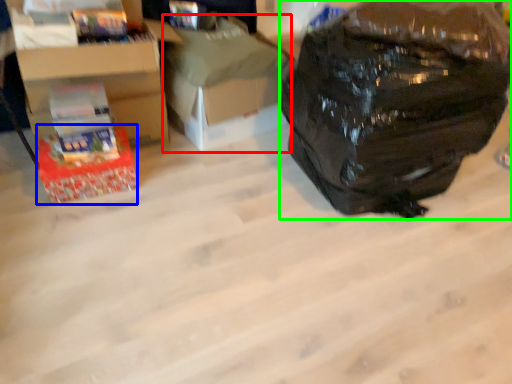
Question: Which object is the farthest from cardboard box (highlighted by a red box)? Choose among these: box (highlighted by a blue box) or backpack (highlighted by a green box).

Choices:
 (A) box
 (B) backpack

Answer: (B)